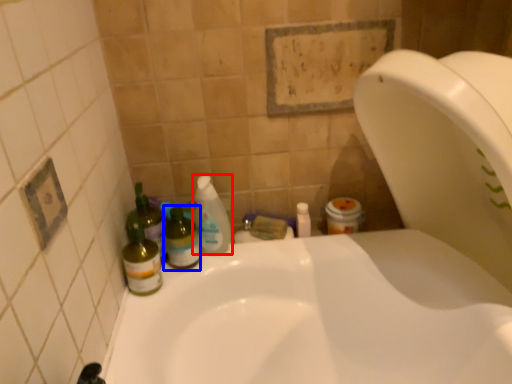
Question: Which object appears closest to the camera in this image, cleaning product (highlighted by a red box) or bottle (highlighted by a blue box)?

Choices:
 (A) cleaning product
 (B) bottle

Answer: (B)